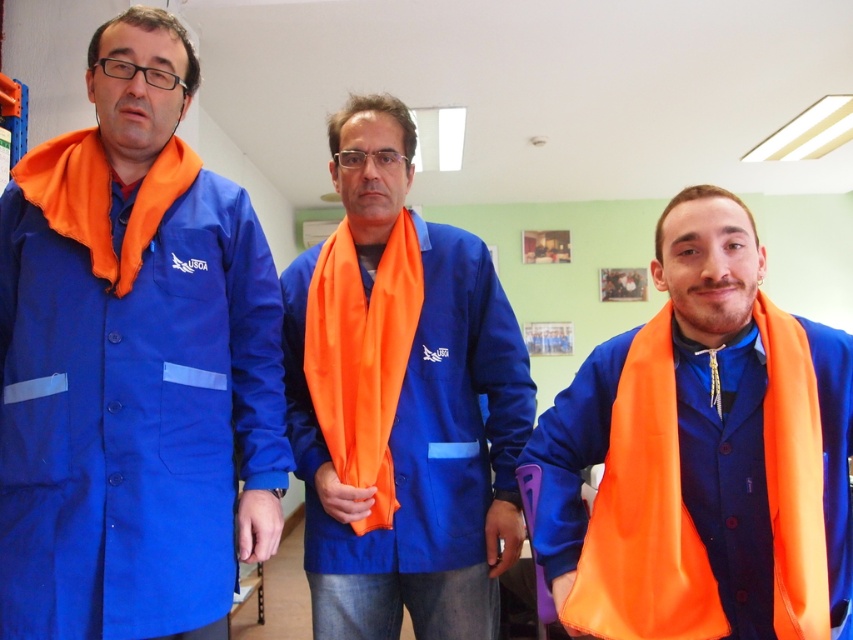
Question: Which point appears closest to the camera in this image?

Choices:
 (A) (164, 125)
 (B) (399, 467)
 (C) (358, 362)
 (D) (648, 516)

Answer: (D)

Question: Which point appears farthest from the camera in this image?

Choices:
 (A) (343, 483)
 (B) (399, 234)
 (C) (99, 314)

Answer: (B)

Question: Does matte blue coat at left appear under orange fabric scarf at right?

Choices:
 (A) yes
 (B) no

Answer: (B)

Question: From the image, what is the correct spatial relationship of orange fabric scarf at right in relation to orange satin scarf at center?

Choices:
 (A) below
 (B) above

Answer: (A)

Question: Observing the image, what is the correct spatial positioning of orange fabric scarf at right in reference to matte blue jacket at center?

Choices:
 (A) below
 (B) above

Answer: (A)

Question: Which of these objects is positioned farthest from the matte blue jacket at center?

Choices:
 (A) orange satin scarf at center
 (B) orange fabric scarf at right

Answer: (B)